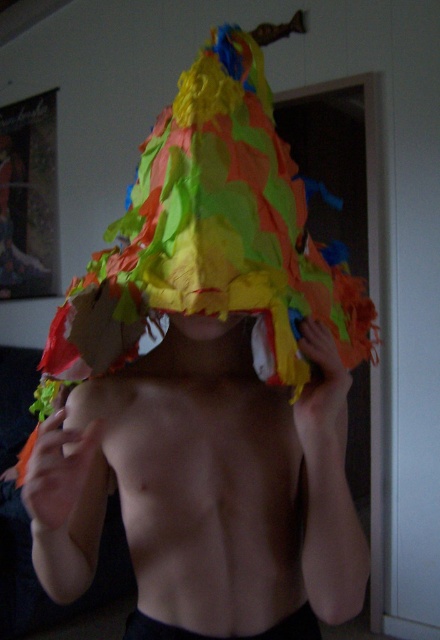
Question: Which of the following is the closest to the observer?

Choices:
 (A) black fabric at center
 (B) matte paper mask at center

Answer: (B)

Question: Does black fabric at center have a greater width compared to matte paper mask at center?

Choices:
 (A) yes
 (B) no

Answer: (A)

Question: Does black fabric at center lie behind matte paper mask at center?

Choices:
 (A) no
 (B) yes

Answer: (B)

Question: Is black fabric at center further to camera compared to matte paper mask at center?

Choices:
 (A) no
 (B) yes

Answer: (B)